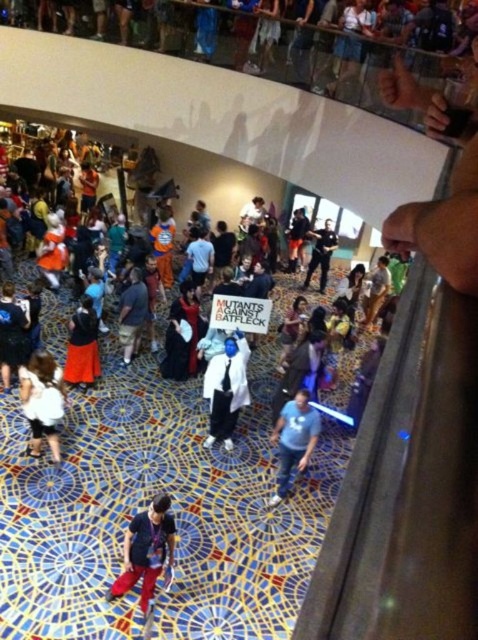
Consider the image. You are a photographer at the convention and need to capture both the blue cotton shirt at center and the matte black suit at center in a single frame. Given their sizes, which one should you focus on to ensure both are visible without zooming in or out?

The blue cotton shirt at center is narrower than the matte black suit at center, so focusing on the matte black suit at center would allow both to fit in the frame since it occupies more space.

You are a photographer at the convention and want to capture both the blue cotton shirt at center and the dark blue fabric shirt at center in a single frame. Which shirt should you focus on to ensure both fit in the photo without cropping?

The blue cotton shirt at center has a larger width than the dark blue fabric shirt at center, so focusing on the blue cotton shirt at center ensures both shirts fit in the photo without cropping.

You are standing in the convention hall and want to take a photo of both the person holding the sign and the crowd in the background. Which of the two points, point (160, 554) or point (223, 426), is closer to the camera?

Point (160, 554) is closer to the camera than point (223, 426).